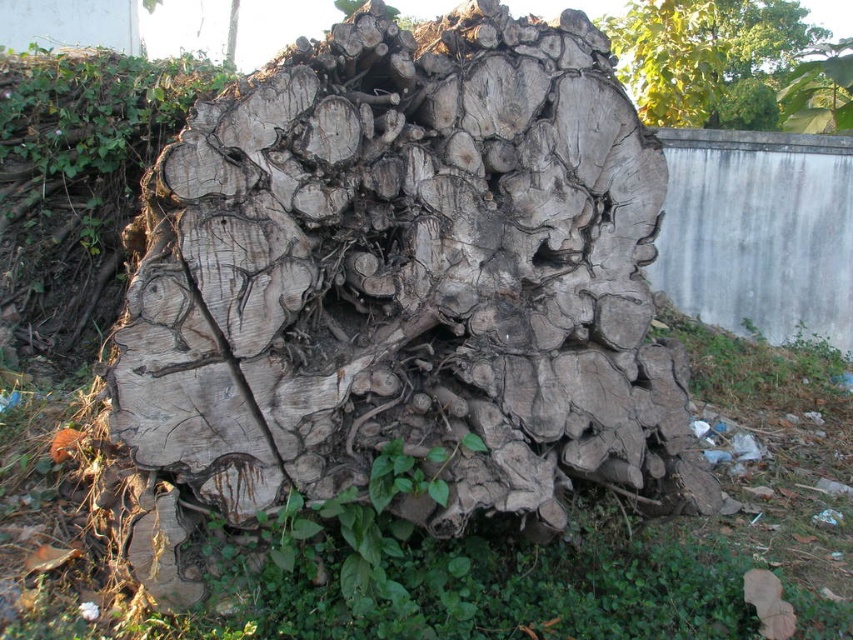
Based on the photo, you are a landscape architect designing a garden. You have a weathered wood log at center and a green leafy tree at upper center in your design. Which object takes up more space in the garden layout?

The green leafy tree at upper center occupies more space than the weathered wood log at center.

You are a delivery person standing at the edge of the grassy area where the weathered wood log at center is located. You need to place a package that is 1.5 meters long on the ground between you and the log. Is there enough space to lay the package flat without it overlapping the log?

The distance between you and the weathered wood log at center is 1.48 meters, which is slightly shorter than the package length of 1.5 meters. Therefore, laying the package flat between you and the log would cause it to overlap the log.

You are standing in a forest clearing and see the weathered wood log at center and the green leafy tree at upper center. Which object is closer to the ground?

The weathered wood log at center is closer to the ground because it is located below the green leafy tree at upper center.